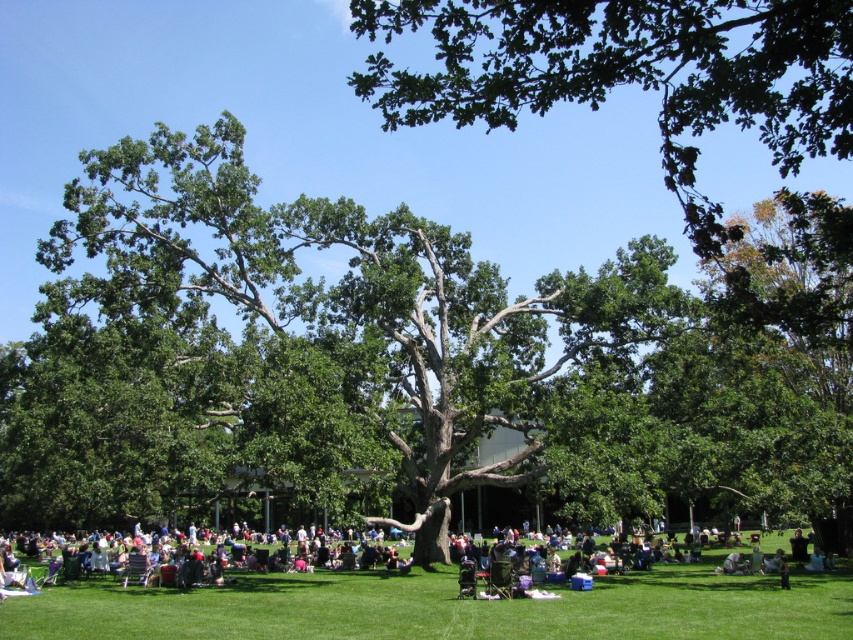
You are planning to set up a picnic blanket for a family gathering. The green leafy tree at center and the dark green fabric chair at lower center are in the way. Which object should you move to make space for the blanket?

The dark green fabric chair at lower center should be moved because it is smaller than the green leafy tree at center, making it easier to relocate.

You are standing at point (401, 358) in the park. What object is located exactly at your current position?

The green leafy tree at center is located exactly at point (401, 358).